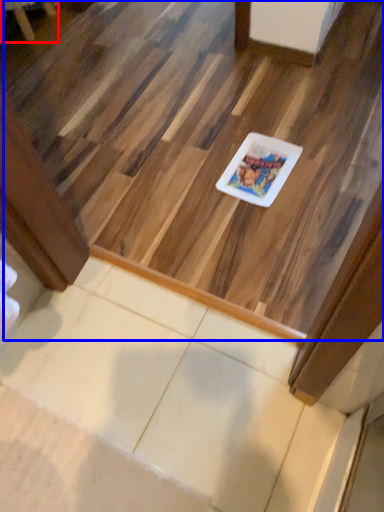
Question: Which point is further to the camera, furniture (highlighted by a red box) or stairwell (highlighted by a blue box)?

Choices:
 (A) furniture
 (B) stairwell

Answer: (A)